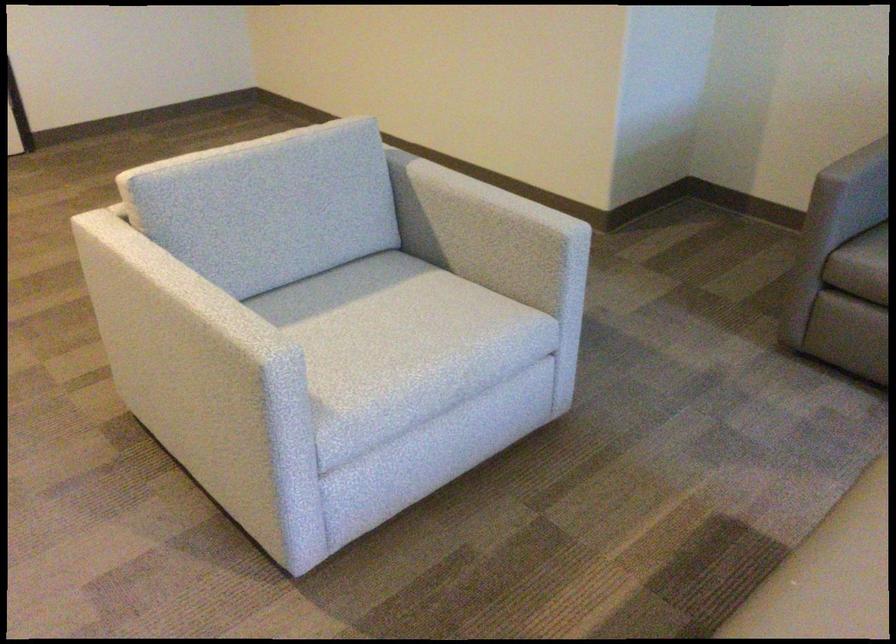
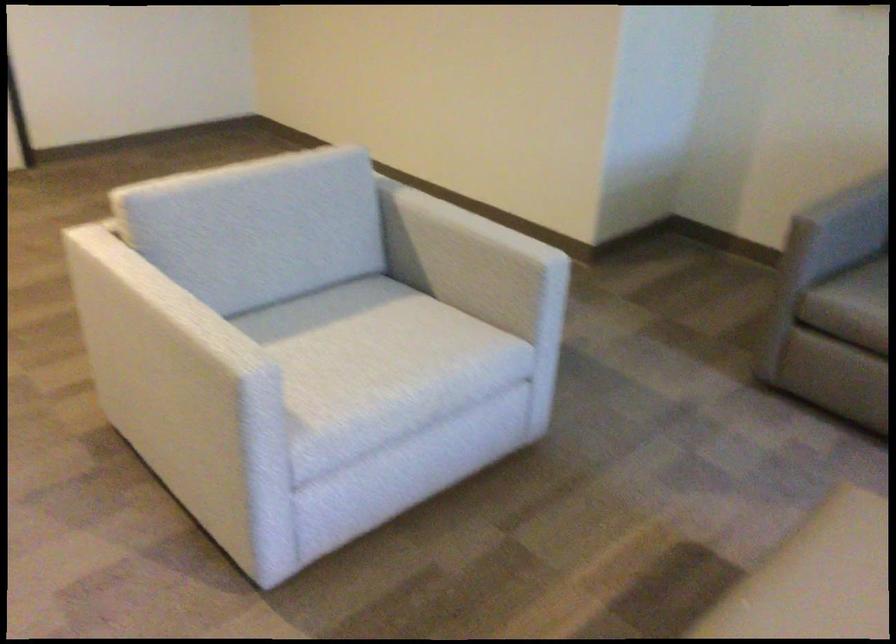
Question: How did the camera likely rotate?

Choices:
 (A) Left
 (B) Right
 (C) Up
 (D) Down

Answer: (C)